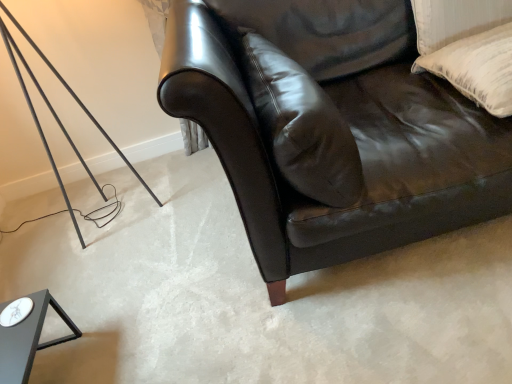
Question: Is leather pillow at center, which is the second pillow from right to left, facing away from shiny black leather couch at center?

Choices:
 (A) yes
 (B) no

Answer: (A)

Question: Is leather pillow at center, the first pillow when ordered from left to right, aimed at shiny black leather couch at center?

Choices:
 (A) no
 (B) yes

Answer: (B)

Question: From the image's perspective, is leather pillow at center, which is the second pillow from right to left, on shiny black leather couch at center?

Choices:
 (A) yes
 (B) no

Answer: (B)

Question: From the image's perspective, is leather pillow at center, which is the second pillow from right to left, beneath shiny black leather couch at center?

Choices:
 (A) no
 (B) yes

Answer: (B)

Question: Considering the relative positions of leather pillow at center, the first pillow when ordered from left to right, and shiny black leather couch at center in the image provided, is leather pillow at center, the first pillow when ordered from left to right, to the right of shiny black leather couch at center from the viewer's perspective?

Choices:
 (A) yes
 (B) no

Answer: (B)

Question: Are leather pillow at center, which is the second pillow from right to left, and shiny black leather couch at center located far from each other?

Choices:
 (A) yes
 (B) no

Answer: (B)

Question: Can you confirm if shiny black leather couch at center is smaller than leather pillow at center, which is the second pillow from right to left?

Choices:
 (A) yes
 (B) no

Answer: (B)

Question: Is shiny black leather couch at center further to the viewer compared to leather pillow at center, the first pillow when ordered from left to right?

Choices:
 (A) yes
 (B) no

Answer: (B)

Question: Is shiny black leather couch at center in contact with leather pillow at center, which is the second pillow from right to left?

Choices:
 (A) yes
 (B) no

Answer: (B)

Question: From a real-world perspective, is shiny black leather couch at center on leather pillow at center, which is the second pillow from right to left?

Choices:
 (A) no
 (B) yes

Answer: (A)

Question: Is shiny black leather couch at center positioned before leather pillow at center, which is the second pillow from right to left?

Choices:
 (A) yes
 (B) no

Answer: (A)

Question: Is shiny black leather couch at center not near leather pillow at center, the first pillow when ordered from left to right?

Choices:
 (A) yes
 (B) no

Answer: (B)

Question: Does white textured pillow at upper right, the first pillow positioned from the right, have a greater height compared to shiny black leather couch at center?

Choices:
 (A) no
 (B) yes

Answer: (A)